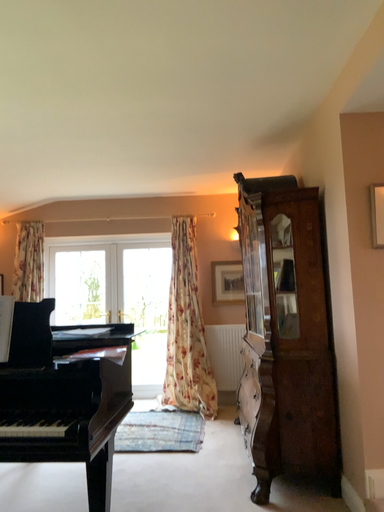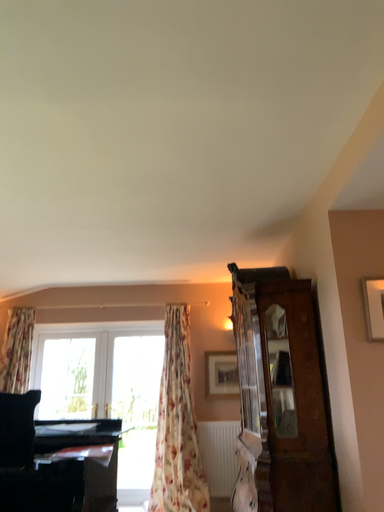
Question: Which way did the camera rotate in the video?

Choices:
 (A) rotated upward
 (B) rotated downward

Answer: (A)